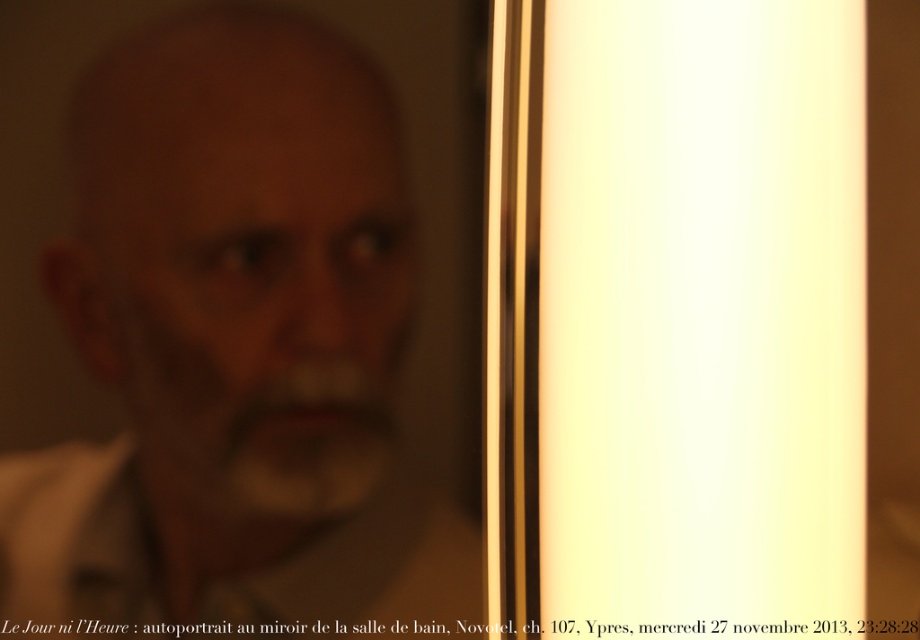
The image size is (920, 640). What do you see at coordinates (236, 353) in the screenshot?
I see `matte white face at center` at bounding box center [236, 353].

Between matte white face at center and brown matte beard at center, which one has less height?

Standing shorter between the two is brown matte beard at center.

Measure the distance between point (440, 614) and camera.

Point (440, 614) is 32.71 inches from camera.

The width and height of the screenshot is (920, 640). I want to click on matte white face at center, so click(236, 353).

Does white cotton dress shirt at left have a larger size compared to brown matte beard at center?

Correct, white cotton dress shirt at left is larger in size than brown matte beard at center.

Which is above, white cotton dress shirt at left or brown matte beard at center?

brown matte beard at center

Describe the element at coordinates (368, 576) in the screenshot. I see `white cotton dress shirt at left` at that location.

Find the location of a particular element. This screenshot has height=640, width=920. white cotton dress shirt at left is located at coordinates (368, 576).

Does matte white face at center have a larger size compared to white cotton dress shirt at left?

Indeed, matte white face at center has a larger size compared to white cotton dress shirt at left.

Between point (115, 294) and point (288, 618), which one is positioned behind?

Positioned behind is point (288, 618).

Between point (173, 573) and point (79, 573), which one is positioned behind?

The point (173, 573) is behind.

The width and height of the screenshot is (920, 640). Find the location of `matte white face at center`. matte white face at center is located at coordinates click(x=236, y=353).